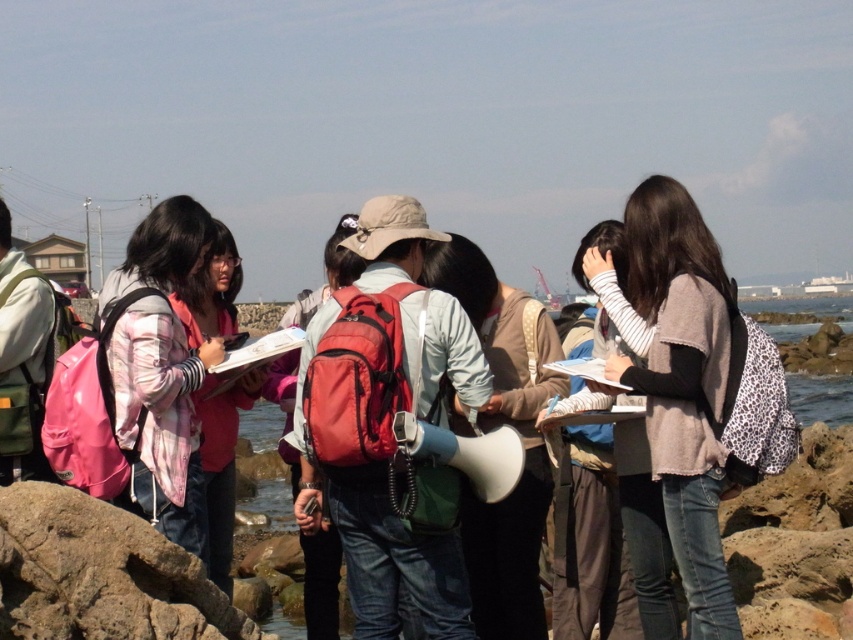
Does point (134, 289) come in front of point (283, 444)?

Yes.

Can you confirm if pink fabric jacket at center is positioned to the left of matte red backpack at center?

Correct, you'll find pink fabric jacket at center to the left of matte red backpack at center.

I want to click on pink fabric jacket at center, so click(x=161, y=371).

Who is shorter, pink fabric jacket at center or matte gray megaphone at center?

pink fabric jacket at center

Which is above, pink fabric jacket at center or matte gray megaphone at center?

pink fabric jacket at center is above.

Identify the location of pink fabric jacket at center. This screenshot has height=640, width=853. (161, 371).

Can you confirm if rough textured rock at lower left is positioned to the left of matte gray megaphone at center?

Yes, rough textured rock at lower left is to the left of matte gray megaphone at center.

Who is more forward, (32, 490) or (485, 598)?

Point (32, 490) is more forward.

At what (x,y) coordinates should I click in order to perform the action: click on rough textured rock at lower left. Please return your answer as a coordinate pair (x, y). This screenshot has height=640, width=853. Looking at the image, I should click on (100, 573).